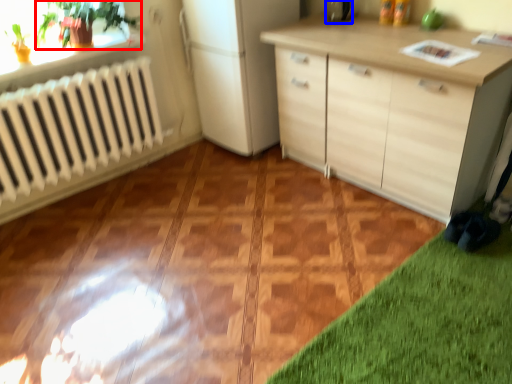
Question: Which of the following is the closest to the observer, plant (highlighted by a red box) or appliance (highlighted by a blue box)?

Choices:
 (A) plant
 (B) appliance

Answer: (A)